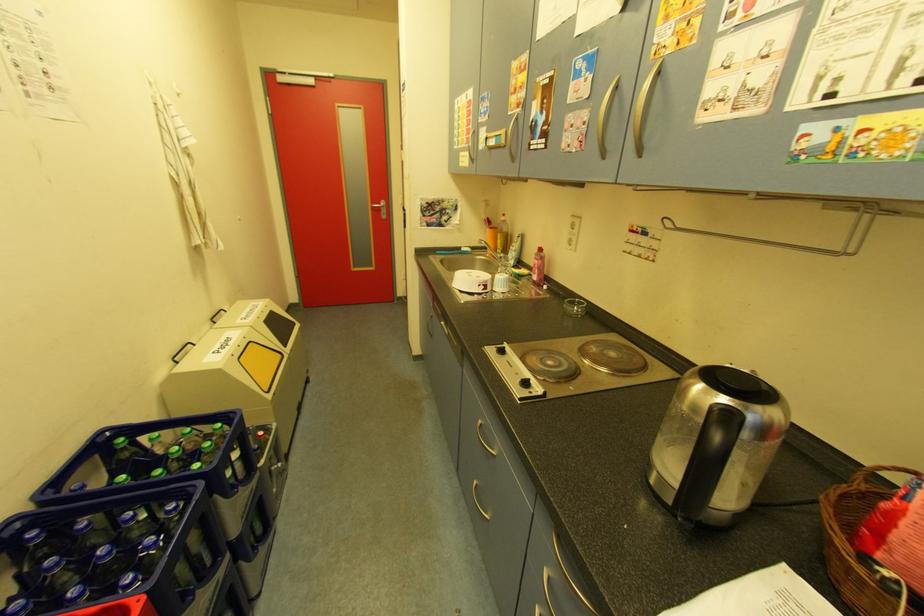
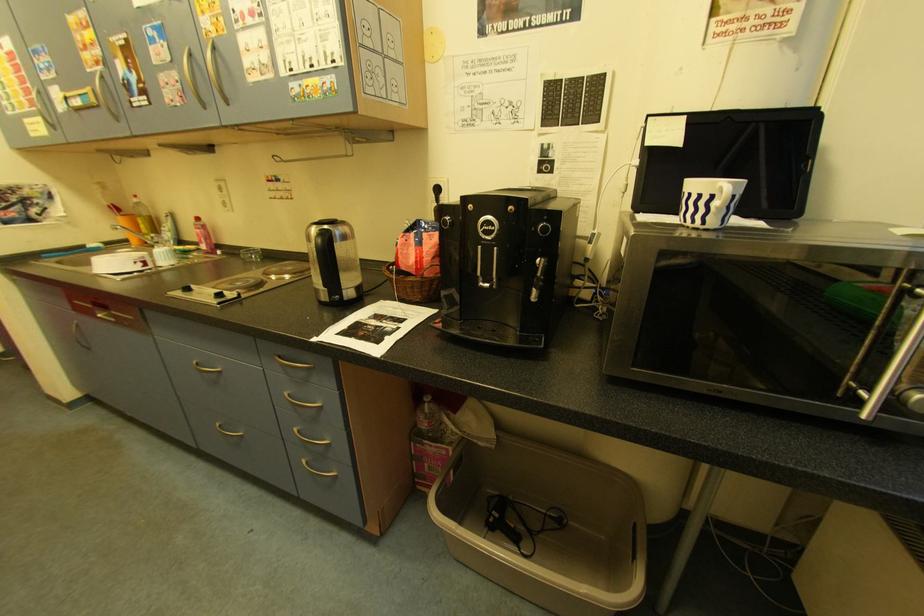
Question: The camera is either moving clockwise (left) or counter-clockwise (right) around the object. The first image is from the beginning of the video and the second image is from the end. Is the camera moving left or right when shooting the video?

Choices:
 (A) Left
 (B) Right

Answer: (A)